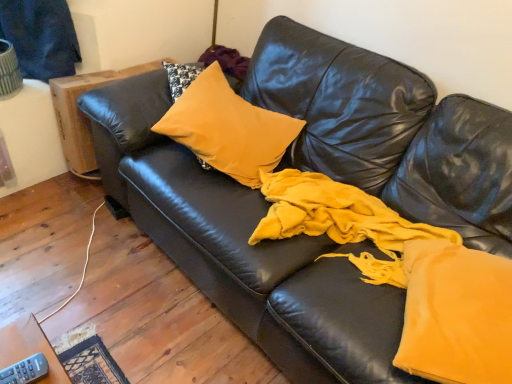
Identify the location of mustard velvet pillow at center. This screenshot has height=384, width=512. (228, 128).

What is the approximate width of wooden side table at left?

The width of wooden side table at left is 29.87 inches.

Find the location of `mustard velvet pillow at center`. mustard velvet pillow at center is located at coordinates (228, 128).

Which object is positioned more to the right, wooden side table at left or gray plastic remote at lower left?

Positioned to the right is gray plastic remote at lower left.

The width and height of the screenshot is (512, 384). I want to click on remote located on the right of wooden side table at left, so click(25, 370).

Considering the relative sizes of wooden side table at left and gray plastic remote at lower left in the image provided, is wooden side table at left taller than gray plastic remote at lower left?

Indeed, wooden side table at left has a greater height compared to gray plastic remote at lower left.

Is wooden side table at left thinner than gray plastic remote at lower left?

In fact, wooden side table at left might be wider than gray plastic remote at lower left.

Is mustard velvet pillow at center positioned beyond the bounds of wooden side table at left?

mustard velvet pillow at center lies outside wooden side table at left's area.

Considering the sizes of mustard velvet pillow at center and wooden side table at left in the image, is mustard velvet pillow at center taller or shorter than wooden side table at left?

mustard velvet pillow at center is shorter than wooden side table at left.

Is mustard velvet pillow at center facing away from wooden side table at left?

mustard velvet pillow at center is not turned away from wooden side table at left.

Is point (196, 124) closer or farther from the camera than point (74, 133)?

Clearly, point (196, 124) is closer to the camera than point (74, 133).

Who is smaller, mustard velvet pillow at center or gray plastic remote at lower left?

With smaller size is gray plastic remote at lower left.

In the scene shown: From the image's perspective, which one is positioned lower, mustard velvet pillow at center or gray plastic remote at lower left?

From the image's view, gray plastic remote at lower left is below.

Can you confirm if mustard velvet pillow at center is positioned to the left of gray plastic remote at lower left?

Incorrect, mustard velvet pillow at center is not on the left side of gray plastic remote at lower left.

From the image's perspective, is gray plastic remote at lower left below wooden side table at left?

Yes, from the image's perspective, gray plastic remote at lower left is below wooden side table at left.

Is gray plastic remote at lower left placed right next to wooden side table at left?

No, gray plastic remote at lower left is not next to wooden side table at left.

Which point is more forward, (14, 376) or (69, 139)?

Point (14, 376)

Is wooden side table at left a part of gray plastic remote at lower left?

No, wooden side table at left is not inside gray plastic remote at lower left.

Does gray plastic remote at lower left contain mustard velvet pillow at center?

Actually, mustard velvet pillow at center is outside gray plastic remote at lower left.

Considering the positions of objects gray plastic remote at lower left and mustard velvet pillow at center in the image provided, who is in front, gray plastic remote at lower left or mustard velvet pillow at center?

Positioned in front is gray plastic remote at lower left.

Can you see gray plastic remote at lower left touching mustard velvet pillow at center?

There is a gap between gray plastic remote at lower left and mustard velvet pillow at center.

From a real-world perspective, which object rests below the other?

In real-world perspective, mustard velvet pillow at center is lower.

Is mustard velvet pillow at center at the back of wooden side table at left?

That's not correct — wooden side table at left is not looking away from mustard velvet pillow at center.

Can you confirm if wooden side table at left is smaller than mustard velvet pillow at center?

Actually, wooden side table at left might be larger than mustard velvet pillow at center.

Is mustard velvet pillow at center a part of wooden side table at left?

Definitely not — mustard velvet pillow at center is not inside wooden side table at left.

Is wooden side table at left far from mustard velvet pillow at center?

wooden side table at left is actually quite close to mustard velvet pillow at center.

This screenshot has width=512, height=384. I want to click on table lying on the left of gray plastic remote at lower left, so click(x=84, y=114).

The width and height of the screenshot is (512, 384). I want to click on pillow below the wooden side table at left (from the image's perspective), so click(228, 128).

Considering their positions, is gray plastic remote at lower left positioned further to wooden side table at left than mustard velvet pillow at center?

gray plastic remote at lower left lies further to wooden side table at left than the other object.

Based on the photo, looking at the image, which one is located further to gray plastic remote at lower left, wooden side table at left or mustard velvet pillow at center?

wooden side table at left.

Based on their spatial positions, is mustard velvet pillow at center or wooden side table at left further from gray plastic remote at lower left?

Based on the image, wooden side table at left appears to be further to gray plastic remote at lower left.

When comparing their distances from wooden side table at left, does mustard velvet pillow at center or gray plastic remote at lower left seem further?

gray plastic remote at lower left.

Estimate the real-world distances between objects in this image. Which object is further from mustard velvet pillow at center, gray plastic remote at lower left or wooden side table at left?

gray plastic remote at lower left lies further to mustard velvet pillow at center than the other object.

Looking at the image, which one is located further to mustard velvet pillow at center, wooden side table at left or gray plastic remote at lower left?

gray plastic remote at lower left lies further to mustard velvet pillow at center than the other object.

Find the location of a particular element. Image resolution: width=512 pixels, height=384 pixels. pillow located between gray plastic remote at lower left and wooden side table at left in the depth direction is located at coordinates [228, 128].